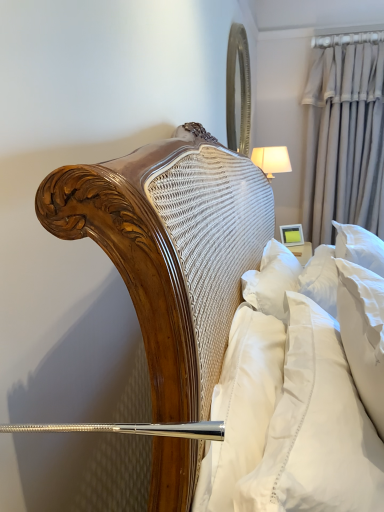
Describe the element at coordinates (344, 139) in the screenshot. I see `beige fabric curtain at upper right` at that location.

The height and width of the screenshot is (512, 384). Describe the element at coordinates (292, 234) in the screenshot. I see `matte yellow picture frame at upper right` at that location.

This screenshot has height=512, width=384. What do you see at coordinates (316, 429) in the screenshot?
I see `white soft pillow at right` at bounding box center [316, 429].

Identify the location of silver/metallic mirror at upper right. The width and height of the screenshot is (384, 512). (238, 91).

At what (x,y) coordinates should I click in order to perform the action: click on beige fabric curtain at upper right. Please return your answer as a coordinate pair (x, y). The height and width of the screenshot is (512, 384). Looking at the image, I should click on (344, 139).

Would you say beige fabric curtain at upper right is to the left or to the right of silver/metallic mirror at upper right in the picture?

beige fabric curtain at upper right is to the right of silver/metallic mirror at upper right.

Can you tell me how much beige fabric curtain at upper right and silver/metallic mirror at upper right differ in facing direction?

They differ by 90.3 degrees in their facing directions.

Is beige fabric curtain at upper right turned away from silver/metallic mirror at upper right?

No, silver/metallic mirror at upper right is not at the back of beige fabric curtain at upper right.

Measure the distance from beige fabric curtain at upper right to silver/metallic mirror at upper right.

beige fabric curtain at upper right is 34.94 inches away from silver/metallic mirror at upper right.

Considering the positions of points (241, 38) and (236, 485), is point (241, 38) closer to camera compared to point (236, 485)?

No, (241, 38) is further to viewer.

Would you say white soft pillow at right is part of silver/metallic mirror at upper right's contents?

No.

In the scene shown: Considering the relative sizes of silver/metallic mirror at upper right and white soft pillow at right in the image provided, is silver/metallic mirror at upper right wider than white soft pillow at right?

Incorrect, the width of silver/metallic mirror at upper right does not surpass that of white soft pillow at right.

Would you consider silver/metallic mirror at upper right to be distant from white soft pillow at right?

silver/metallic mirror at upper right is far away from white soft pillow at right.

Are white soft pillow at right and silver/metallic mirror at upper right beside each other?

No, white soft pillow at right is not beside silver/metallic mirror at upper right.

Considering the sizes of white soft pillow at right and silver/metallic mirror at upper right in the image, is white soft pillow at right wider or thinner than silver/metallic mirror at upper right?

Considering their sizes, white soft pillow at right looks broader than silver/metallic mirror at upper right.

From a real-world perspective, relative to silver/metallic mirror at upper right, is white soft pillow at right vertically above or below?

white soft pillow at right is below silver/metallic mirror at upper right.

Which object is further away from the camera taking this photo, white soft pillow at right or silver/metallic mirror at upper right?

Positioned behind is silver/metallic mirror at upper right.

From a real-world perspective, is white fabric lampshade at upper right under matte yellow picture frame at upper right?

No.

Is white fabric lampshade at upper right positioned far away from matte yellow picture frame at upper right?

No, white fabric lampshade at upper right is in close proximity to matte yellow picture frame at upper right.

Is matte yellow picture frame at upper right a part of white fabric lampshade at upper right?

No, white fabric lampshade at upper right does not contain matte yellow picture frame at upper right.

Who is shorter, silver/metallic mirror at upper right or beige fabric curtain at upper right?

With less height is silver/metallic mirror at upper right.

Consider the image. Could beige fabric curtain at upper right be considered to be inside silver/metallic mirror at upper right?

Definitely not — beige fabric curtain at upper right is not inside silver/metallic mirror at upper right.

Is silver/metallic mirror at upper right in contact with beige fabric curtain at upper right?

No, silver/metallic mirror at upper right is not in contact with beige fabric curtain at upper right.

Can you confirm if beige fabric curtain at upper right is bigger than white soft pillow at right?

Yes.

Does beige fabric curtain at upper right have a greater width compared to white soft pillow at right?

Yes, beige fabric curtain at upper right is wider than white soft pillow at right.

From a real-world perspective, which is physically below, beige fabric curtain at upper right or white soft pillow at right?

From a 3D spatial view, white soft pillow at right is below.

Can you confirm if beige fabric curtain at upper right is taller than white soft pillow at right?

Yes, beige fabric curtain at upper right is taller than white soft pillow at right.

Can silver/metallic mirror at upper right be found inside matte yellow picture frame at upper right?

No, silver/metallic mirror at upper right is located outside of matte yellow picture frame at upper right.

Is matte yellow picture frame at upper right next to silver/metallic mirror at upper right and touching it?

No, matte yellow picture frame at upper right is not next to silver/metallic mirror at upper right.

Does matte yellow picture frame at upper right have a smaller size compared to silver/metallic mirror at upper right?

Yes, matte yellow picture frame at upper right is smaller than silver/metallic mirror at upper right.

Consider the image. Can you confirm if matte yellow picture frame at upper right is shorter than silver/metallic mirror at upper right?

Indeed, matte yellow picture frame at upper right has a lesser height compared to silver/metallic mirror at upper right.

Find the location of a particular element. mirror that is above the beige fabric curtain at upper right (from a real-world perspective) is located at coordinates (238, 91).

The width and height of the screenshot is (384, 512). I want to click on mirror behind the white soft pillow at right, so click(x=238, y=91).

Considering their positions, is matte yellow picture frame at upper right positioned further to silver/metallic mirror at upper right than white soft pillow at right?

Based on the image, white soft pillow at right appears to be further to silver/metallic mirror at upper right.

Based on their spatial positions, is white soft pillow at right or matte yellow picture frame at upper right further from white fabric lampshade at upper right?

Based on the image, white soft pillow at right appears to be further to white fabric lampshade at upper right.

From the image, which object appears to be farther from silver/metallic mirror at upper right, matte yellow picture frame at upper right or beige fabric curtain at upper right?

The object further to silver/metallic mirror at upper right is matte yellow picture frame at upper right.

Estimate the real-world distances between objects in this image. Which object is closer to silver/metallic mirror at upper right, beige fabric curtain at upper right or white soft pillow at right?

Based on the image, beige fabric curtain at upper right appears to be nearer to silver/metallic mirror at upper right.

Based on their spatial positions, is silver/metallic mirror at upper right or white soft pillow at right further from beige fabric curtain at upper right?

The object further to beige fabric curtain at upper right is white soft pillow at right.

When comparing their distances from matte yellow picture frame at upper right, does white soft pillow at right or beige fabric curtain at upper right seem closer?

beige fabric curtain at upper right is positioned closer to the anchor matte yellow picture frame at upper right.

Which object lies further to the anchor point white fabric lampshade at upper right, beige fabric curtain at upper right or silver/metallic mirror at upper right?

beige fabric curtain at upper right is positioned further to the anchor white fabric lampshade at upper right.

Which object lies nearer to the anchor point silver/metallic mirror at upper right, matte yellow picture frame at upper right or white fabric lampshade at upper right?

The object closer to silver/metallic mirror at upper right is white fabric lampshade at upper right.

This screenshot has height=512, width=384. I want to click on mirror positioned between white soft pillow at right and white fabric lampshade at upper right from near to far, so click(238, 91).

The image size is (384, 512). Find the location of `bedside lamp between silver/metallic mirror at upper right and beige fabric curtain at upper right from left to right`. bedside lamp between silver/metallic mirror at upper right and beige fabric curtain at upper right from left to right is located at coordinates [x=272, y=160].

Image resolution: width=384 pixels, height=512 pixels. Identify the location of bedside lamp between silver/metallic mirror at upper right and matte yellow picture frame at upper right in the up-down direction. (272, 160).

The height and width of the screenshot is (512, 384). I want to click on mirror between white soft pillow at right and matte yellow picture frame at upper right from front to back, so click(238, 91).